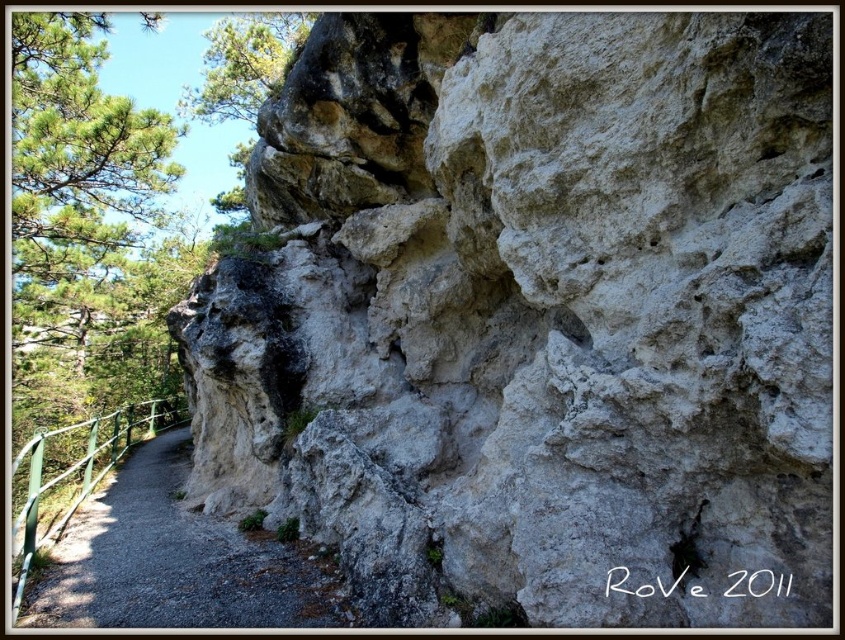
Question: Among these objects, which one is farthest from the camera?

Choices:
 (A) green leafy tree at upper center
 (B) green metal rail at lower left
 (C) gray gravel path at lower left

Answer: (A)

Question: Which of these objects is positioned closest to the green leafy tree at upper center?

Choices:
 (A) gray gravel path at lower left
 (B) green metal rail at lower left

Answer: (A)

Question: Is gray gravel path at lower left thinner than green metal rail at lower left?

Choices:
 (A) no
 (B) yes

Answer: (A)

Question: Which of these objects is positioned closest to the gray gravel path at lower left?

Choices:
 (A) green leafy tree at upper center
 (B) green metal rail at lower left

Answer: (B)

Question: Is gray gravel path at lower left positioned in front of green metal rail at lower left?

Choices:
 (A) no
 (B) yes

Answer: (B)

Question: Is gray gravel path at lower left positioned before green leafy tree at upper center?

Choices:
 (A) yes
 (B) no

Answer: (A)